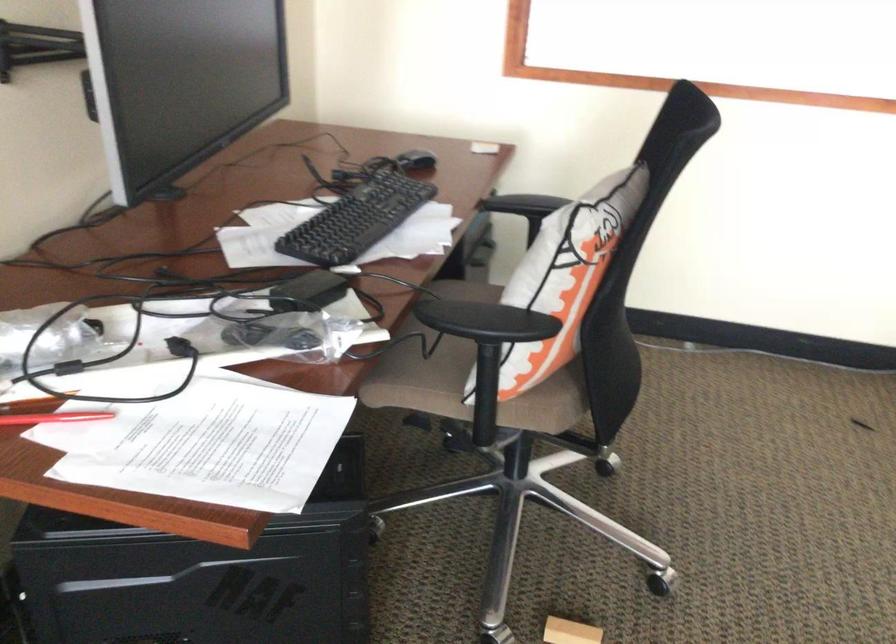
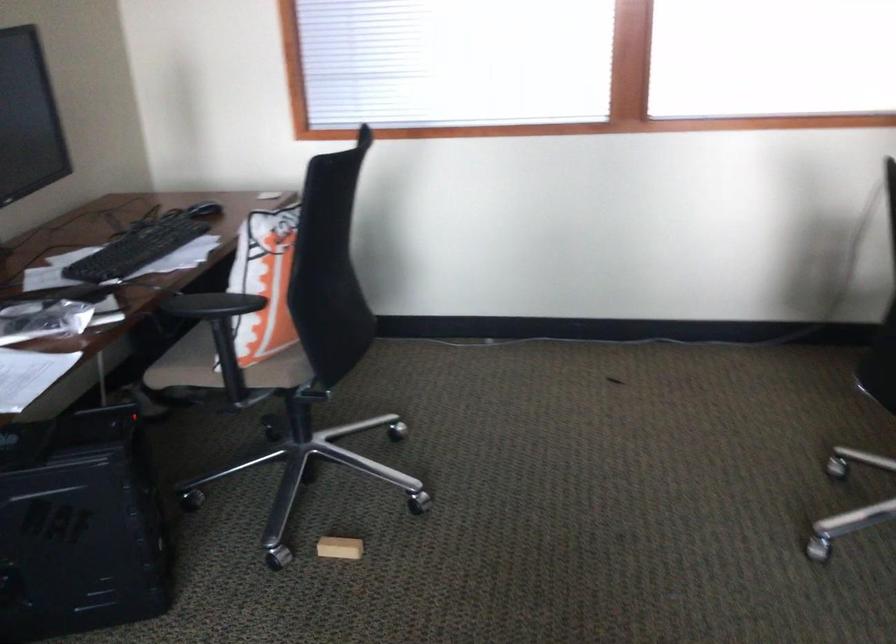
Locate, in the second image, the point that corresponds to pixel 489 327 in the first image.

(211, 305)